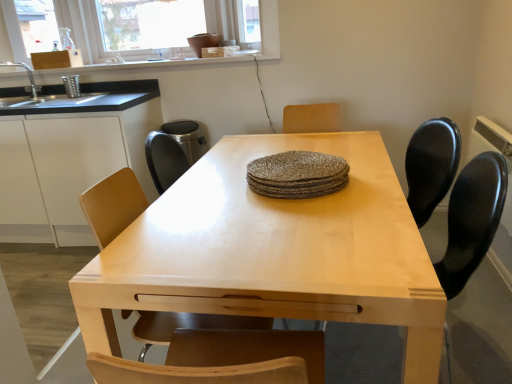
Question: Would you say white matte cabinet at left is part of light wood table at center's contents?

Choices:
 (A) no
 (B) yes

Answer: (A)

Question: From the image's perspective, is light wood table at center beneath white matte cabinet at left?

Choices:
 (A) yes
 (B) no

Answer: (A)

Question: Is light wood table at center aimed at white matte cabinet at left?

Choices:
 (A) no
 (B) yes

Answer: (B)

Question: Is light wood table at center not close to white matte cabinet at left?

Choices:
 (A) no
 (B) yes

Answer: (B)

Question: Considering the relative positions of light wood table at center and white matte cabinet at left in the image provided, is light wood table at center to the left of white matte cabinet at left from the viewer's perspective?

Choices:
 (A) yes
 (B) no

Answer: (B)

Question: From the image's perspective, is black granite countertop at left located above or below black plastic swivel chair at right?

Choices:
 (A) below
 (B) above

Answer: (B)

Question: In terms of size, does black granite countertop at left appear bigger or smaller than black plastic swivel chair at right?

Choices:
 (A) small
 (B) big

Answer: (A)

Question: In the image, is black granite countertop at left positioned in front of or behind black plastic swivel chair at right?

Choices:
 (A) front
 (B) behind

Answer: (B)

Question: From a real-world perspective, relative to black plastic swivel chair at right, is black granite countertop at left vertically above or below?

Choices:
 (A) below
 (B) above

Answer: (B)

Question: Is transparent glass window screen at upper center taller or shorter than black plastic swivel chair at right?

Choices:
 (A) short
 (B) tall

Answer: (A)

Question: Is point (117, 23) positioned closer to the camera than point (361, 375)?

Choices:
 (A) closer
 (B) farther

Answer: (B)

Question: Is transparent glass window screen at upper center in front of or behind black plastic swivel chair at right in the image?

Choices:
 (A) behind
 (B) front

Answer: (A)

Question: Visually, is transparent glass window screen at upper center positioned to the left or to the right of black plastic swivel chair at right?

Choices:
 (A) right
 (B) left

Answer: (B)

Question: From the image's perspective, is black granite countertop at left positioned above or below light wood table at center?

Choices:
 (A) below
 (B) above

Answer: (B)

Question: In the image, is black granite countertop at left on the left side or the right side of light wood table at center?

Choices:
 (A) left
 (B) right

Answer: (A)